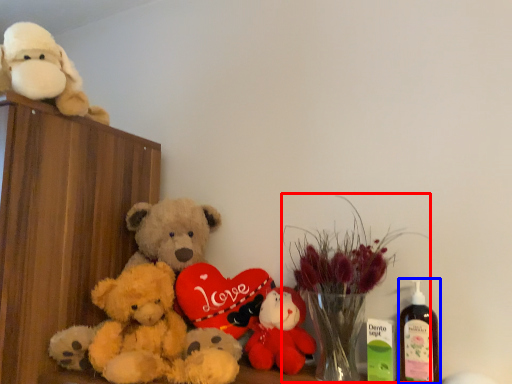
Question: Which point is further to the camera, floral arrangement (highlighted by a red box) or bottle (highlighted by a blue box)?

Choices:
 (A) floral arrangement
 (B) bottle

Answer: (B)